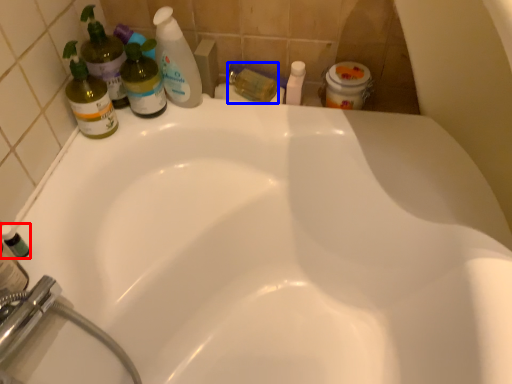
Question: Which of the following is the closest to the observer, mouthwash (highlighted by a red box) or toiletry (highlighted by a blue box)?

Choices:
 (A) mouthwash
 (B) toiletry

Answer: (A)